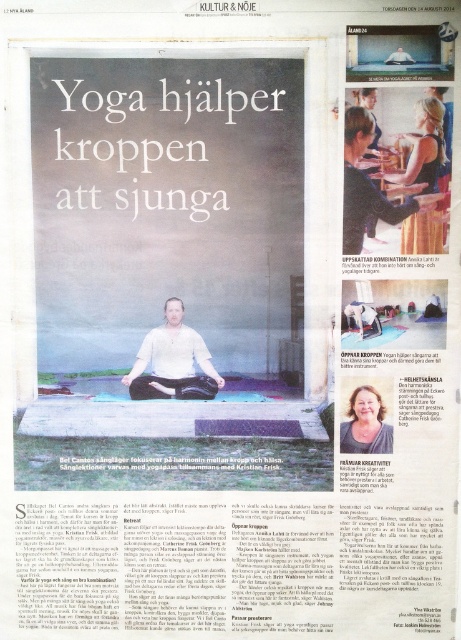
Is white matte shirt at center positioned in front of matte white shirt at center?

No, white matte shirt at center is further to the viewer.

Find the location of a particular element. This screenshot has height=640, width=461. white matte shirt at center is located at coordinates (172, 362).

The image size is (461, 640). What do you see at coordinates (172, 362) in the screenshot?
I see `white matte shirt at center` at bounding box center [172, 362].

Where is `white matte shirt at center`? The height and width of the screenshot is (640, 461). white matte shirt at center is located at coordinates (172, 362).

Who is positioned more to the left, white matte shirt at center or matte brown hair at lower right?

From the viewer's perspective, white matte shirt at center appears more on the left side.

Can you confirm if white matte shirt at center is thinner than matte brown hair at lower right?

No, white matte shirt at center is not thinner than matte brown hair at lower right.

The height and width of the screenshot is (640, 461). What are the coordinates of `white matte shirt at center` in the screenshot? It's located at (172, 362).

Where is `matte brown hair at lower right`? The height and width of the screenshot is (640, 461). matte brown hair at lower right is located at coordinates (366, 422).

You are a GUI agent. You are given a task and a screenshot of the screen. Output one action in this format:
    pyautogui.click(x=<x>, y=<y>)
    Task: Click on the matte brown hair at lower right
    This screenshot has width=461, height=640.
    Given the screenshot: What is the action you would take?
    366,422